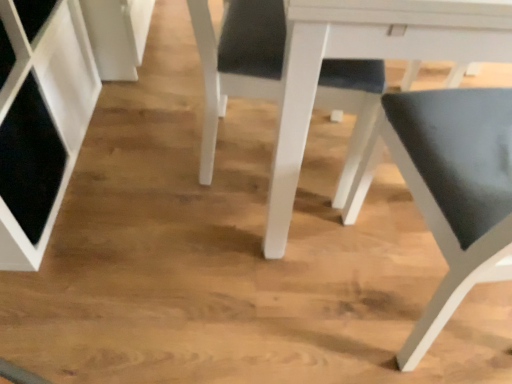
The image size is (512, 384). Identify the location of matte black chair at lower right, which ranks as the first chair in right-to-left order. (449, 188).

What do you see at coordinates (367, 57) in the screenshot?
I see `white glossy table at center` at bounding box center [367, 57].

Image resolution: width=512 pixels, height=384 pixels. I want to click on matte black chair at center, the first chair positioned from the left, so click(x=237, y=61).

Which object is positioned more to the left, matte black chair at center, the first chair positioned from the left, or matte black chair at lower right, the second chair viewed from the left?

matte black chair at center, the first chair positioned from the left.

Considering the points (362, 96) and (510, 203), which point is in front, point (362, 96) or point (510, 203)?

The point (510, 203) is closer to the camera.

Is matte black chair at lower right, which ranks as the first chair in right-to-left order, at the back of matte black chair at center, the first chair positioned from the left?

No, matte black chair at lower right, which ranks as the first chair in right-to-left order, is not at the back of matte black chair at center, the first chair positioned from the left.

How different are the orientations of matte black chair at center, arranged as the second chair when viewed from the right, and matte black chair at lower right, the second chair viewed from the left, in degrees?

The facing directions of matte black chair at center, arranged as the second chair when viewed from the right, and matte black chair at lower right, the second chair viewed from the left, are 99.4 degrees apart.

Is matte black chair at center, arranged as the second chair when viewed from the right, oriented away from white glossy table at center?

Yes, matte black chair at center, arranged as the second chair when viewed from the right,'s orientation is away from white glossy table at center.

Between matte black chair at center, the first chair positioned from the left, and white glossy table at center, which one has larger width?

white glossy table at center.

From a real-world perspective, which is physically below, matte black chair at center, arranged as the second chair when viewed from the right, or white glossy table at center?

In real-world perspective, matte black chair at center, arranged as the second chair when viewed from the right, is lower.

Find the location of a particular element. Image resolution: width=512 pixels, height=384 pixels. table on the right of matte black chair at center, arranged as the second chair when viewed from the right is located at coordinates (367, 57).

Can you confirm if white glossy table at center is bigger than matte black chair at center, arranged as the second chair when viewed from the right?

Yes, white glossy table at center is bigger than matte black chair at center, arranged as the second chair when viewed from the right.

Would you say white glossy table at center is outside matte black chair at center, arranged as the second chair when viewed from the right?

white glossy table at center lies outside matte black chair at center, arranged as the second chair when viewed from the right,'s area.

From the picture: From a real-world perspective, is white glossy table at center below matte black chair at center, arranged as the second chair when viewed from the right?

No.

From the picture: From a real-world perspective, is white glossy table at center on matte black chair at lower right, the second chair viewed from the left?

No, from a real-world perspective, white glossy table at center is not over matte black chair at lower right, the second chair viewed from the left

Is white glossy table at center with matte black chair at lower right, the second chair viewed from the left?

No, white glossy table at center is not with matte black chair at lower right, the second chair viewed from the left.

Based on the photo, from the image's perspective, does white glossy table at center appear higher than matte black chair at lower right, the second chair viewed from the left?

Indeed, from the image's perspective, white glossy table at center is shown above matte black chair at lower right, the second chair viewed from the left.

Looking at this image, considering the sizes of objects white glossy table at center and matte black chair at lower right, the second chair viewed from the left, in the image provided, who is taller, white glossy table at center or matte black chair at lower right, the second chair viewed from the left,?

matte black chair at lower right, the second chair viewed from the left.

Which object is closer to the camera taking this photo, matte black chair at lower right, which ranks as the first chair in right-to-left order, or white glossy table at center?

matte black chair at lower right, which ranks as the first chair in right-to-left order, is in front.

Where is `the 2nd chair positioned below the white glossy table at center (from the image's perspective)`? This screenshot has width=512, height=384. the 2nd chair positioned below the white glossy table at center (from the image's perspective) is located at coordinates (449, 188).

From a real-world perspective, does matte black chair at lower right, which ranks as the first chair in right-to-left order, sit lower than white glossy table at center?

No, from a real-world perspective, matte black chair at lower right, which ranks as the first chair in right-to-left order, is not under white glossy table at center.

Considering the relative sizes of matte black chair at lower right, the second chair viewed from the left, and white glossy table at center in the image provided, is matte black chair at lower right, the second chair viewed from the left, smaller than white glossy table at center?

Yes.

This screenshot has width=512, height=384. I want to click on chair above the matte black chair at lower right, which ranks as the first chair in right-to-left order (from the image's perspective), so click(x=237, y=61).

Which is behind, point (423, 180) or point (334, 98)?

The point (334, 98) is farther.

From the picture: Which object is closer to the camera, matte black chair at lower right, the second chair viewed from the left, or matte black chair at center, arranged as the second chair when viewed from the right?

matte black chair at lower right, the second chair viewed from the left, is closer to the camera.

Is matte black chair at lower right, the second chair viewed from the left, next to matte black chair at center, the first chair positioned from the left, and touching it?

matte black chair at lower right, the second chair viewed from the left, is not next to matte black chair at center, the first chair positioned from the left, and they're not touching.

I want to click on chair on the right of matte black chair at center, arranged as the second chair when viewed from the right, so click(449, 188).

This screenshot has width=512, height=384. Identify the location of chair that appears below the white glossy table at center (from a real-world perspective). (237, 61).

When comparing their distances from matte black chair at center, arranged as the second chair when viewed from the right, does matte black chair at lower right, the second chair viewed from the left, or white glossy table at center seem closer?

Based on the image, white glossy table at center appears to be nearer to matte black chair at center, arranged as the second chair when viewed from the right.

Looking at the image, which one is located further to white glossy table at center, matte black chair at center, arranged as the second chair when viewed from the right, or matte black chair at lower right, which ranks as the first chair in right-to-left order?

Among the two, matte black chair at lower right, which ranks as the first chair in right-to-left order, is located further to white glossy table at center.

Looking at the image, which one is located further to matte black chair at center, the first chair positioned from the left, white glossy table at center or matte black chair at lower right, which ranks as the first chair in right-to-left order?

The object further to matte black chair at center, the first chair positioned from the left, is matte black chair at lower right, which ranks as the first chair in right-to-left order.

Based on the photo, estimate the real-world distances between objects in this image. Which object is further from matte black chair at lower right, the second chair viewed from the left, white glossy table at center or matte black chair at center, the first chair positioned from the left?

matte black chair at center, the first chair positioned from the left, is positioned further to the anchor matte black chair at lower right, the second chair viewed from the left.

Based on their spatial positions, is matte black chair at center, the first chair positioned from the left, or white glossy table at center further from matte black chair at lower right, the second chair viewed from the left?

matte black chair at center, the first chair positioned from the left.

When comparing their distances from white glossy table at center, does matte black chair at lower right, which ranks as the first chair in right-to-left order, or matte black chair at center, arranged as the second chair when viewed from the right, seem closer?

The object closer to white glossy table at center is matte black chair at center, arranged as the second chair when viewed from the right.

Locate an element on the screen. table between matte black chair at center, arranged as the second chair when viewed from the right, and matte black chair at lower right, which ranks as the first chair in right-to-left order is located at coordinates (367, 57).